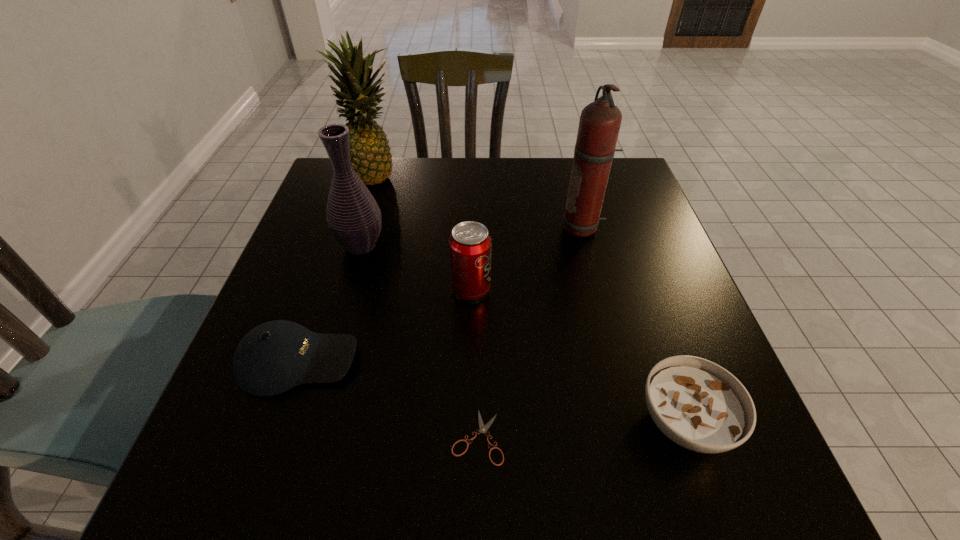
I want to click on vacant space situated 0.400m on the side of the fire extinguisher with the label and nozzle, so click(396, 228).

Find the location of a particular element. Image resolution: width=960 pixels, height=540 pixels. free region located on the side of the fire extinguisher with the label and nozzle is located at coordinates (417, 228).

The width and height of the screenshot is (960, 540). I want to click on vacant space located 0.130m on the right of the vase, so click(x=443, y=245).

Where is `vacant space located 0.310m on the back of the fourth farthest object`? vacant space located 0.310m on the back of the fourth farthest object is located at coordinates (473, 193).

At what (x,y) coordinates should I click in order to perform the action: click on vacant region located on the front-facing side of the baseball cap. Please return your answer as a coordinate pair (x, y). This screenshot has width=960, height=540. Looking at the image, I should click on (508, 361).

Image resolution: width=960 pixels, height=540 pixels. Identify the location of free space located on the back of the soup bowl. (640, 295).

The height and width of the screenshot is (540, 960). I want to click on free point located 0.160m on the back of the shortest object, so click(478, 333).

Identify the location of object present at the far edge. (371, 159).

Identify the location of soup bowl present at the near edge. Image resolution: width=960 pixels, height=540 pixels. (699, 405).

Image resolution: width=960 pixels, height=540 pixels. In order to click on shears situated at the near edge in this screenshot , I will do `click(483, 429)`.